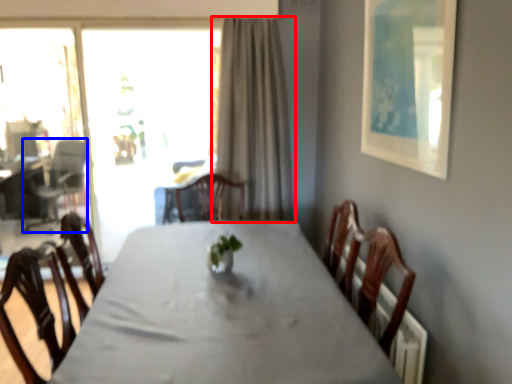
Question: Which object appears closest to the camera in this image, curtain (highlighted by a red box) or armchair (highlighted by a blue box)?

Choices:
 (A) curtain
 (B) armchair

Answer: (A)